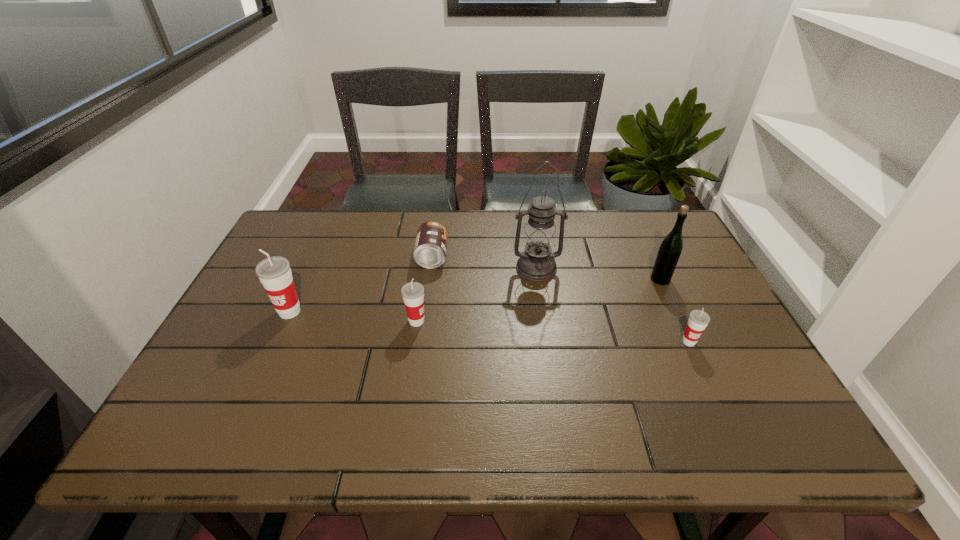
Locate an element on the screen. vacant space situated 0.200m on the side of the tallest cup with the logo is located at coordinates (254, 389).

Where is `blank area located on the side of the fourth tallest object with the logo`? Image resolution: width=960 pixels, height=540 pixels. blank area located on the side of the fourth tallest object with the logo is located at coordinates (517, 321).

The width and height of the screenshot is (960, 540). Find the location of `blank space located on the side of the shortest cup with the logo`. blank space located on the side of the shortest cup with the logo is located at coordinates (713, 395).

This screenshot has height=540, width=960. Find the location of `free space located 0.300m on the front of the oil lamp`. free space located 0.300m on the front of the oil lamp is located at coordinates (551, 368).

Locate an element on the screen. The height and width of the screenshot is (540, 960). free location located 0.210m on the front label of the shortest object is located at coordinates (517, 256).

The image size is (960, 540). In order to click on vacant space located on the back of the beer bottle in this screenshot , I will do `click(632, 219)`.

The height and width of the screenshot is (540, 960). I want to click on object that is at the far edge, so click(x=430, y=248).

This screenshot has height=540, width=960. I want to click on object present at the left edge, so click(x=274, y=273).

At what (x,y) coordinates should I click in order to perform the action: click on cup positioned at the right edge. Please return your answer as a coordinate pair (x, y). Looking at the image, I should click on tap(698, 320).

Find the location of a particular element. beer bottle situated at the right edge is located at coordinates (671, 247).